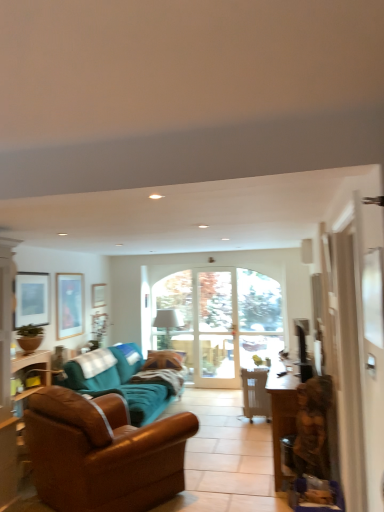
Question: Is matte black picture frame at upper left, the 3th picture frame from the back, wider than teal fabric couch at center, which is the second studio couch in front-to-back order?

Choices:
 (A) no
 (B) yes

Answer: (A)

Question: From the image's perspective, does matte black picture frame at upper left, the 3th picture frame from the back, appear lower than teal fabric couch at center, which is counted as the first studio couch, starting from the back?

Choices:
 (A) no
 (B) yes

Answer: (A)

Question: From a real-world perspective, is matte black picture frame at upper left, the 3th picture frame from the back, positioned under teal fabric couch at center, which is the second studio couch in front-to-back order, based on gravity?

Choices:
 (A) yes
 (B) no

Answer: (B)

Question: Does matte black picture frame at upper left, the 3th picture frame positioned from the right, have a lesser width compared to teal fabric couch at center, which is counted as the first studio couch, starting from the back?

Choices:
 (A) yes
 (B) no

Answer: (A)

Question: Are matte black picture frame at upper left, which is the first picture frame from front to back, and teal fabric couch at center, which is counted as the first studio couch, starting from the back, making contact?

Choices:
 (A) no
 (B) yes

Answer: (A)

Question: From their relative heights in the image, would you say matte wooden picture frame at upper left, arranged as the 1th picture frame when viewed from the right, is taller or shorter than matte black picture frame at upper left, which is the first picture frame from front to back?

Choices:
 (A) tall
 (B) short

Answer: (B)

Question: Considering their positions, is matte wooden picture frame at upper left, the 3th picture frame from the front, located in front of or behind matte black picture frame at upper left, which is the first picture frame from front to back?

Choices:
 (A) behind
 (B) front

Answer: (A)

Question: From the image's perspective, is matte wooden picture frame at upper left, which is counted as the 1th picture frame, starting from the back, located above or below matte black picture frame at upper left, the 1th picture frame in the left-to-right sequence?

Choices:
 (A) below
 (B) above

Answer: (A)

Question: From a real-world perspective, is matte wooden picture frame at upper left, arranged as the 1th picture frame when viewed from the right, above or below matte black picture frame at upper left, the 3th picture frame from the back?

Choices:
 (A) below
 (B) above

Answer: (A)

Question: Is white fabric lampshade at center wider or thinner than satin black television at right?

Choices:
 (A) thin
 (B) wide

Answer: (B)

Question: Is point (172, 318) closer or farther from the camera than point (299, 346)?

Choices:
 (A) closer
 (B) farther

Answer: (B)

Question: Is white fabric lampshade at center in front of or behind satin black television at right in the image?

Choices:
 (A) behind
 (B) front

Answer: (A)

Question: Is white fabric lampshade at center spatially inside satin black television at right, or outside of it?

Choices:
 (A) inside
 (B) outside

Answer: (B)

Question: Is metallic silver chair at center to the left or to the right of matte wooden picture frame at upper left, arranged as the 1th picture frame when viewed from the right, in the image?

Choices:
 (A) left
 (B) right

Answer: (B)

Question: Considering the positions of metallic silver chair at center and matte wooden picture frame at upper left, which is counted as the 1th picture frame, starting from the back, in the image, is metallic silver chair at center wider or thinner than matte wooden picture frame at upper left, which is counted as the 1th picture frame, starting from the back,?

Choices:
 (A) wide
 (B) thin

Answer: (A)